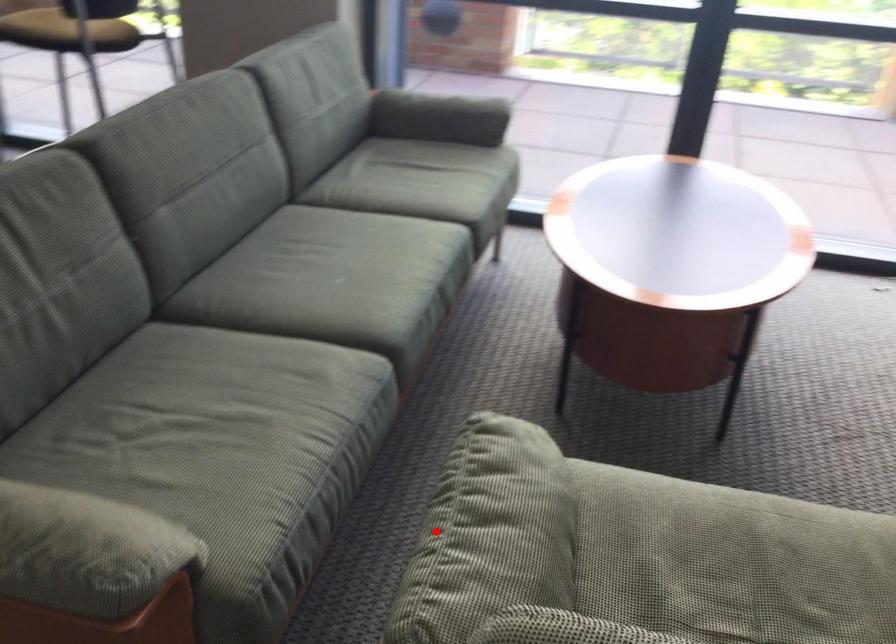
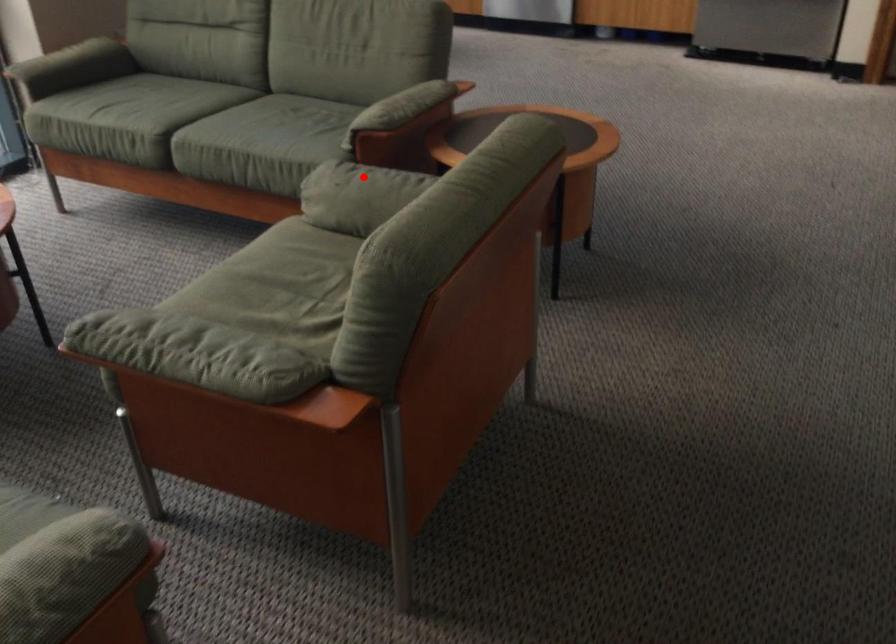
I am providing you with two images of the same scene from different viewpoints. A red point is marked on the first image and another point is marked on the second image. Is the red point in image1 aligned with the point shown in image2?

No